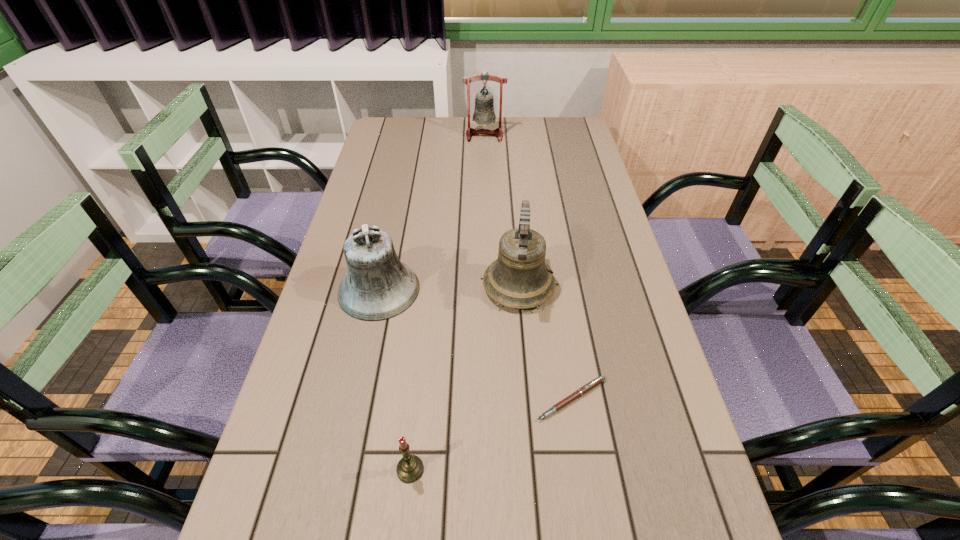
Find the location of a particular element. free space between the fourth object from right to left and the leftmost bell is located at coordinates (x=395, y=380).

Select which object is the closest to the leftmost bell. Please provide its 2D coordinates. Your answer should be formatted as a tuple, i.e. [(x, y)], where the tuple contains the x and y coordinates of a point satisfying the conditions above.

[(519, 278)]

The image size is (960, 540). I want to click on object that stands as the closest to the shortest object, so click(x=519, y=278).

Find the location of a particular element. bell that is the second closest to the leftmost bell is located at coordinates (x=484, y=113).

Identify which bell is located as the second nearest to the leftmost bell. Please provide its 2D coordinates. Your answer should be formatted as a tuple, i.e. [(x, y)], where the tuple contains the x and y coordinates of a point satisfying the conditions above.

[(484, 113)]